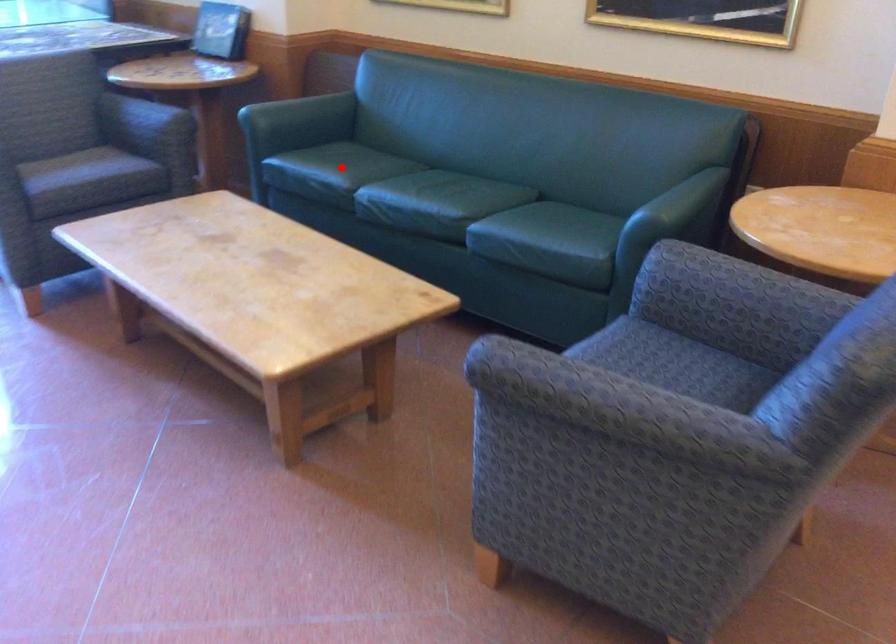
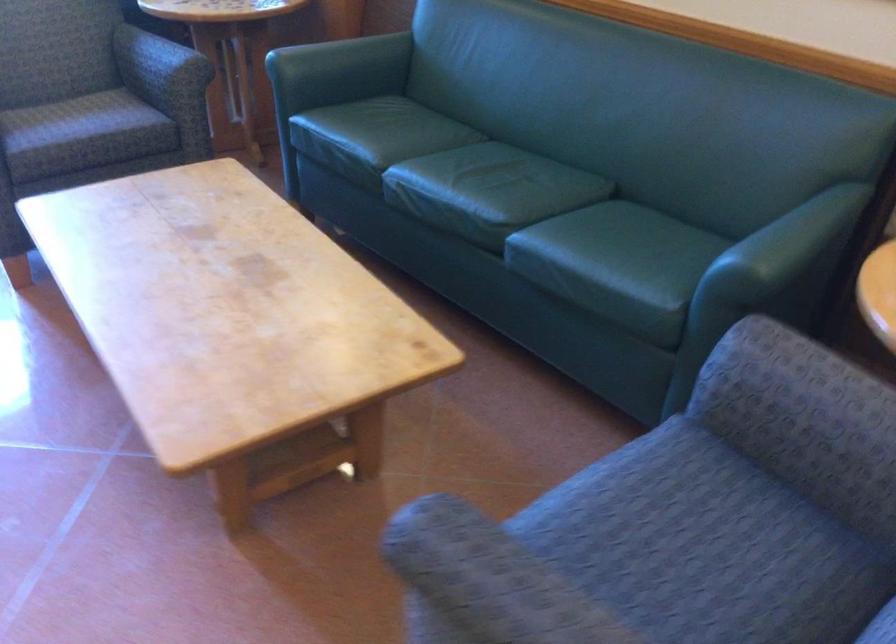
Where in the second image is the point corresponding to the highlighted location from the first image?

(374, 137)